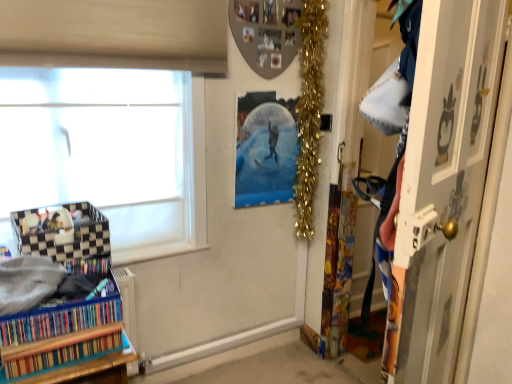
Question: From the image's perspective, does multicolored cardboard at lower left, which is the second book from bottom to top, appear higher than gold tinsel garland at upper right?

Choices:
 (A) yes
 (B) no

Answer: (B)

Question: Is gold tinsel garland at upper right inside multicolored cardboard at lower left, placed as the 1th book when sorted from top to bottom?

Choices:
 (A) no
 (B) yes

Answer: (A)

Question: Can you confirm if multicolored cardboard at lower left, placed as the 1th book when sorted from top to bottom, is smaller than gold tinsel garland at upper right?

Choices:
 (A) no
 (B) yes

Answer: (B)

Question: Is multicolored cardboard at lower left, which is the second book from bottom to top, at the right side of gold tinsel garland at upper right?

Choices:
 (A) no
 (B) yes

Answer: (A)

Question: Would you say multicolored cardboard at lower left, placed as the 1th book when sorted from top to bottom, is outside gold tinsel garland at upper right?

Choices:
 (A) yes
 (B) no

Answer: (A)

Question: From a real-world perspective, is multicolored cardboard at lower left, which is the second book from bottom to top, positioned over gold tinsel garland at upper right based on gravity?

Choices:
 (A) no
 (B) yes

Answer: (A)

Question: Is checkered fabric basket at lower left surrounded by white frosted glass window at left?

Choices:
 (A) no
 (B) yes

Answer: (A)

Question: From a real-world perspective, is white frosted glass window at left positioned over checkered fabric basket at lower left based on gravity?

Choices:
 (A) yes
 (B) no

Answer: (A)

Question: Considering the relative positions of white frosted glass window at left and checkered fabric basket at lower left in the image provided, is white frosted glass window at left to the left of checkered fabric basket at lower left from the viewer's perspective?

Choices:
 (A) no
 (B) yes

Answer: (A)

Question: Considering the relative positions of white frosted glass window at left and checkered fabric basket at lower left in the image provided, is white frosted glass window at left to the right of checkered fabric basket at lower left from the viewer's perspective?

Choices:
 (A) yes
 (B) no

Answer: (A)

Question: Is white frosted glass window at left shorter than checkered fabric basket at lower left?

Choices:
 (A) no
 (B) yes

Answer: (A)

Question: Is white frosted glass window at left facing away from checkered fabric basket at lower left?

Choices:
 (A) no
 (B) yes

Answer: (B)

Question: Would you say multicolored cardboard at lower left, which is the second book from bottom to top, contains multicolored cardboard book at lower left, which is the second book from top to bottom?

Choices:
 (A) yes
 (B) no

Answer: (B)